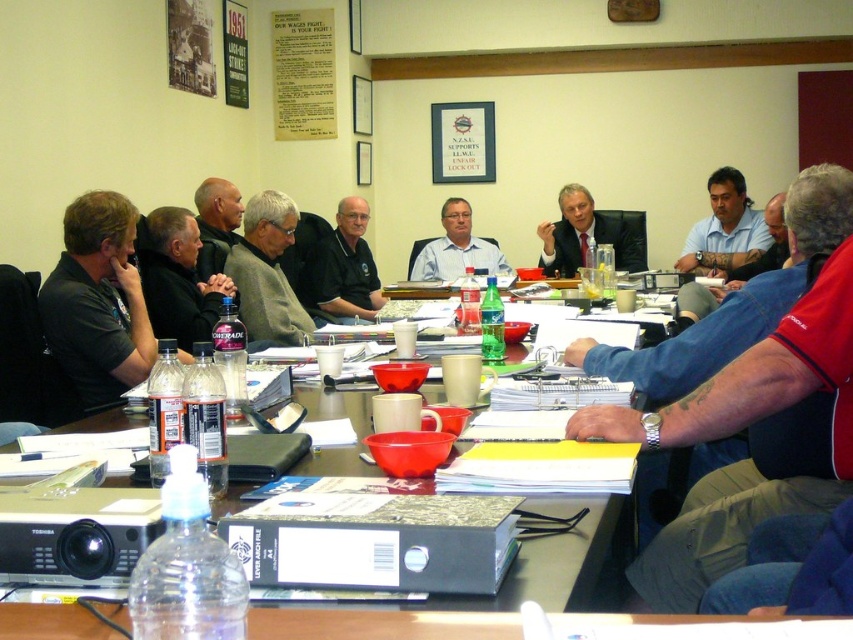
Is black matte shirt at left to the left of matte black suit at center from the viewer's perspective?

Yes, black matte shirt at left is to the left of matte black suit at center.

Describe the element at coordinates (177, 276) in the screenshot. The image size is (853, 640). I see `black matte shirt at left` at that location.

This screenshot has width=853, height=640. Find the location of `black matte shirt at left`. black matte shirt at left is located at coordinates (177, 276).

Is gray sweater at center bigger than paper poster at upper center?

Correct, gray sweater at center is larger in size than paper poster at upper center.

Who is higher up, gray sweater at center or paper poster at upper center?

paper poster at upper center

At what (x,y) coordinates should I click in order to perform the action: click on gray sweater at center. Please return your answer as a coordinate pair (x, y). Looking at the image, I should click on (267, 273).

Where is `gray sweater at center`? gray sweater at center is located at coordinates (267, 273).

Who is lower down, matte black suit at center or matte blue shirt at center?

Positioned lower is matte black suit at center.

Who is more forward, (558, 273) or (424, 272)?

Point (558, 273) is in front.

You are a GUI agent. You are given a task and a screenshot of the screen. Output one action in this format:
    pyautogui.click(x=<x>, y=<y>)
    Task: Click on the matte black suit at center
    Image resolution: width=853 pixels, height=640 pixels.
    Given the screenshot: What is the action you would take?
    pyautogui.click(x=584, y=236)